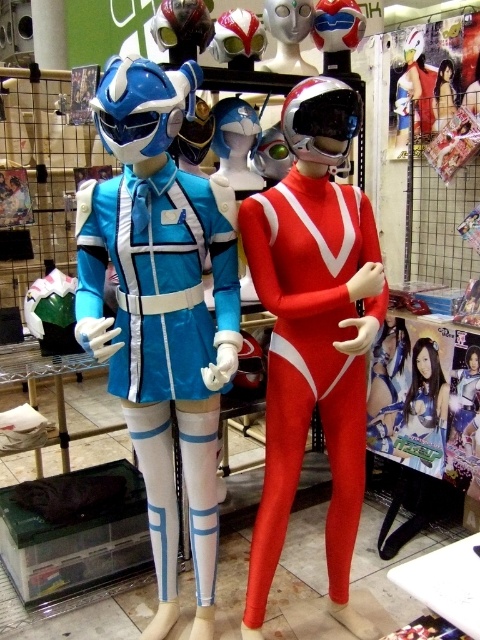
Question: Is shiny silver armor at center below blue glossy helmet at center?

Choices:
 (A) no
 (B) yes

Answer: (B)

Question: Is shiny silver armor at center closer to camera compared to shiny silver helmet at center?

Choices:
 (A) no
 (B) yes

Answer: (A)

Question: Which point appears farthest from the camera in this image?

Choices:
 (A) (327, 12)
 (B) (291, 0)

Answer: (A)

Question: Which object is closer to the camera taking this photo?

Choices:
 (A) shiny silver helmet at center
 (B) shiny metallic helmet at center

Answer: (B)

Question: Does shiny blue and white costume at center have a smaller size compared to shiny red spandex suit at center?

Choices:
 (A) yes
 (B) no

Answer: (B)

Question: Which point is closer to the camera taking this photo?

Choices:
 (A) (206, 506)
 (B) (201, 44)

Answer: (A)